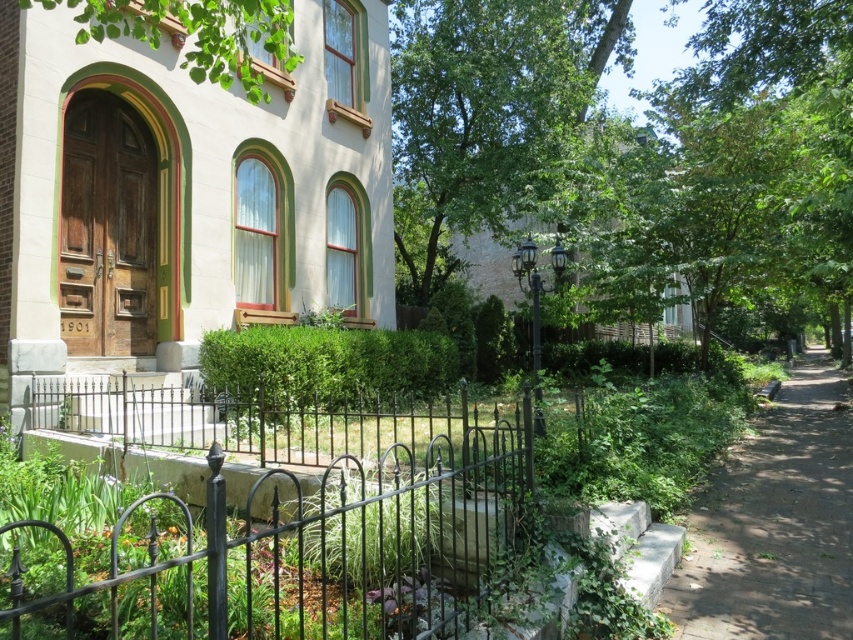
Which is in front, point (782, 394) or point (270, 48)?

Point (270, 48)

Does dirt path at right have a lesser width compared to green leafy tree at upper left?

No.

Who is more distant from viewer, (787, 472) or (151, 4)?

Point (787, 472)

Find the location of `dirt path at right`. dirt path at right is located at coordinates (775, 524).

Who is more forward, (498, 33) or (744, 566)?

Point (744, 566) is more forward.

Can you confirm if green leafy tree at center is shorter than dirt path at right?

No.

Locate an element on the screen. The width and height of the screenshot is (853, 640). green leafy tree at center is located at coordinates (486, 115).

Does point (521, 525) come in front of point (200, 12)?

That is True.

Is black wrought iron fence at lower center bigger than green leafy tree at upper left?

Indeed, black wrought iron fence at lower center has a larger size compared to green leafy tree at upper left.

Image resolution: width=853 pixels, height=640 pixels. What are the coordinates of `black wrought iron fence at lower center` in the screenshot? It's located at (306, 547).